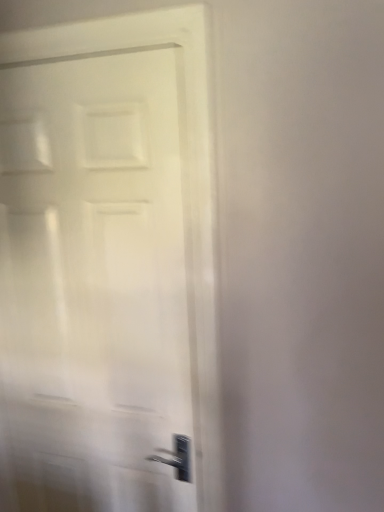
Identify the location of free point above white glossy door at left (from a real-world perspective). (67, 53).